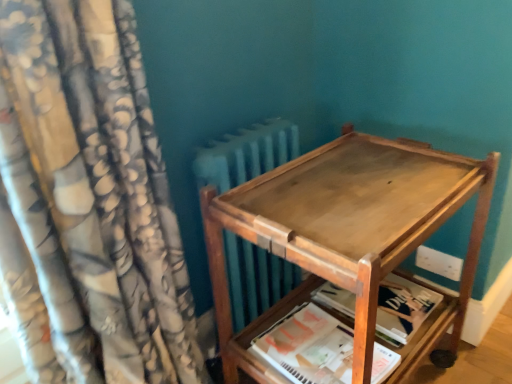
Question: From a real-world perspective, is white paper at lower center, the second paperback book when ordered from back to front, physically located above or below floral fabric curtain at left?

Choices:
 (A) above
 (B) below

Answer: (B)

Question: From the image's perspective, relative to floral fabric curtain at left, is white paper at lower center, the second paperback book when ordered from back to front, above or below?

Choices:
 (A) above
 (B) below

Answer: (B)

Question: Based on their relative distances, which object is nearer to the wooden tray at center?

Choices:
 (A) white paper at lower center, the second paperback book when ordered from back to front
 (B) floral fabric curtain at left
 (C) wooden paperback book at lower right, which is the second paperback book in front-to-back order

Answer: (A)

Question: Which object is the farthest from the wooden paperback book at lower right, which is the second paperback book in front-to-back order?

Choices:
 (A) white paper at lower center, the second paperback book when ordered from back to front
 (B) wooden tray at center
 (C) floral fabric curtain at left

Answer: (C)